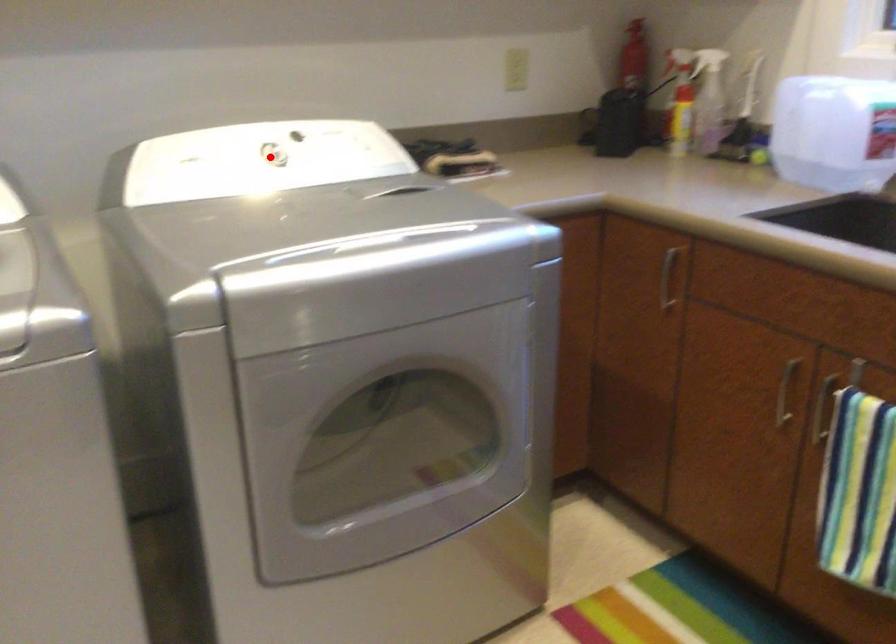
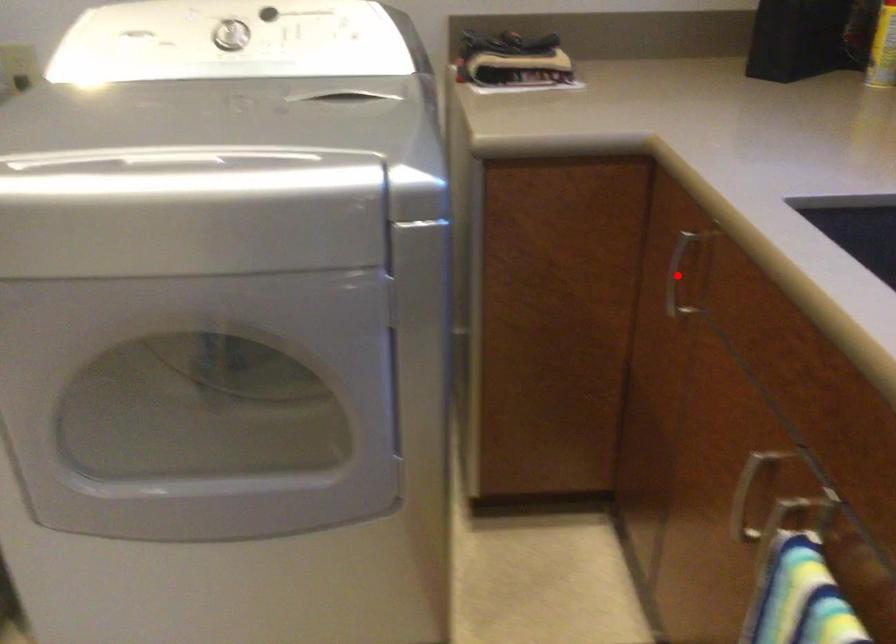
I am providing you with two images of the same scene from different viewpoints. A red point is marked on the first image and another point is marked on the second image. Is the red point in image1 aligned with the point shown in image2?

No